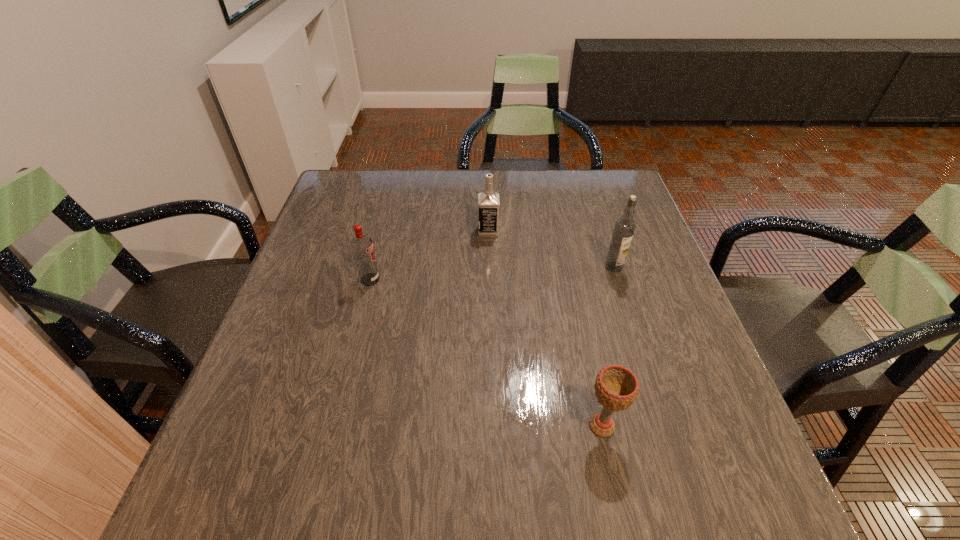
You are a GUI agent. You are given a task and a screenshot of the screen. Output one action in this format:
    pyautogui.click(x=<x>, y=<y>)
    Task: Click on the vacant space situated on the front label of the second vodka from left to right
    This screenshot has width=960, height=540.
    Given the screenshot: What is the action you would take?
    pyautogui.click(x=349, y=231)

Image resolution: width=960 pixels, height=540 pixels. I want to click on vacant space located 0.350m on the front label of the leftmost object, so click(525, 279).

Locate an element on the screen. The width and height of the screenshot is (960, 540). free space located on the back of the nearest object is located at coordinates (591, 376).

Where is `object that is at the right edge`? This screenshot has height=540, width=960. object that is at the right edge is located at coordinates (624, 228).

The height and width of the screenshot is (540, 960). In the image, there is a desktop. Identify the location of free space at the far edge. tap(518, 206).

I want to click on free space at the near edge of the desktop, so click(x=650, y=502).

At what (x,y) coordinates should I click in order to perform the action: click on free space at the left edge of the desktop. Please return your answer as a coordinate pair (x, y). Looking at the image, I should click on (368, 226).

The height and width of the screenshot is (540, 960). Identify the location of vacant space at the right edge. click(719, 431).

This screenshot has height=540, width=960. I want to click on vacant region at the far left corner, so click(x=324, y=199).

Locate an element on the screen. vacant area at the near left corner of the desktop is located at coordinates (289, 472).